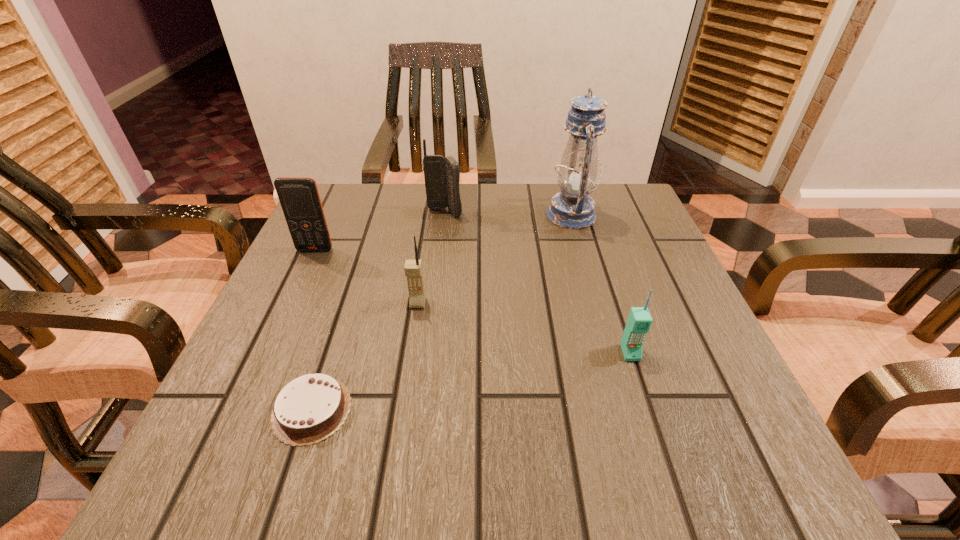
Find the location of a particular element. free space at the far left corner is located at coordinates (384, 211).

In order to click on vacant region at the near left corner of the desktop in this screenshot , I will do `click(274, 474)`.

You are a GUI agent. You are given a task and a screenshot of the screen. Output one action in this format:
    pyautogui.click(x=<x>, y=<y>)
    Task: Click on the free spot at the far right corner of the desktop
    This screenshot has width=960, height=540.
    Given the screenshot: What is the action you would take?
    pyautogui.click(x=609, y=225)

Locate an element on the screen. free space between the second nearest cellular telephone and the tallest object is located at coordinates (494, 259).

Identify the location of free point between the farthest cellular telephone and the tallest object. Image resolution: width=960 pixels, height=540 pixels. (508, 214).

Image resolution: width=960 pixels, height=540 pixels. I want to click on free spot between the chocolate cake and the third farthest cellular telephone, so click(365, 356).

Image resolution: width=960 pixels, height=540 pixels. Find the location of `vacant space that is in between the fifth farthest object and the fifth object from right to left`. vacant space that is in between the fifth farthest object and the fifth object from right to left is located at coordinates (471, 381).

The height and width of the screenshot is (540, 960). Find the location of `free spot between the chocolate cake and the fifth farthest object`. free spot between the chocolate cake and the fifth farthest object is located at coordinates (471, 381).

I want to click on empty space between the fourth farthest object and the fourth nearest object, so click(367, 276).

Locate an element on the screen. This screenshot has height=540, width=960. vacant area that lies between the farthest cellular telephone and the fifth tallest object is located at coordinates (538, 282).